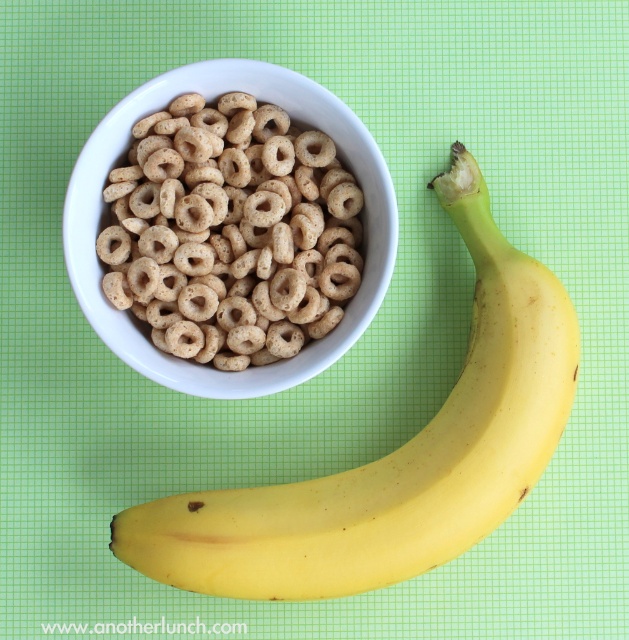
You are trying to decide whether to place the yellow smooth banana at lower right into a container that can only fit items narrower than the brown matte cereal loops at center. Based on their widths, can the banana fit?

The yellow smooth banana at lower right might be wider than brown matte cereal loops at center, so it may not fit in the container if the container is sized to only accommodate items narrower than the cereal loops.

You are arranging food items on a table and need to place the yellow smooth banana at lower right and the brown matte cereal loops at center. According to the image, where is the banana positioned relative to the cereal loops?

The yellow smooth banana at lower right is located below the brown matte cereal loops at center.

Consider the image. You are planning to pack a lunchbox and need to know which item is bigger between the yellow smooth banana at lower right and the brown matte cereal loops at center. Which one should you choose if you want the larger item?

The yellow smooth banana at lower right is larger than the brown matte cereal loops at center, so you should choose the yellow smooth banana at lower right if you want the larger item.